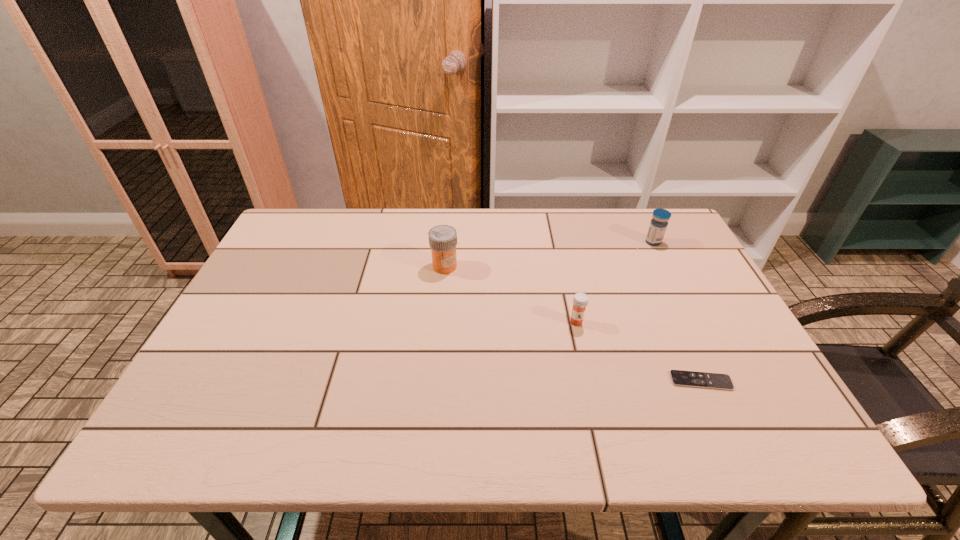
Locate an element on the screen. This screenshot has height=540, width=960. vacant space at the far left corner of the desktop is located at coordinates (282, 231).

This screenshot has width=960, height=540. Identify the location of free space at the far right corner. (631, 232).

I want to click on free area in between the rightmost medicine and the second nearest object, so click(614, 282).

At what (x,y) coordinates should I click in order to perform the action: click on free point between the remote control and the third tallest object. Please return your answer as a coordinate pair (x, y). The image size is (960, 540). Looking at the image, I should click on coord(638,352).

Identify the location of vacant area between the second farthest medicine and the farthest object. (549, 254).

At what (x,y) coordinates should I click in order to perform the action: click on vacant area between the shortest medicine and the leftmost object. Please return your answer as a coordinate pair (x, y). Image resolution: width=960 pixels, height=540 pixels. Looking at the image, I should click on (511, 294).

This screenshot has width=960, height=540. I want to click on empty location between the farthest medicine and the second shortest object, so click(x=614, y=282).

Find the location of `unoccupied position between the farthest medicine and the second farthest object`. unoccupied position between the farthest medicine and the second farthest object is located at coordinates (549, 254).

In order to click on free space between the second nearest object and the nearest object in this screenshot , I will do `click(638, 352)`.

Locate an element on the screen. The width and height of the screenshot is (960, 540). free spot between the farthest object and the second farthest medicine is located at coordinates tap(549, 254).